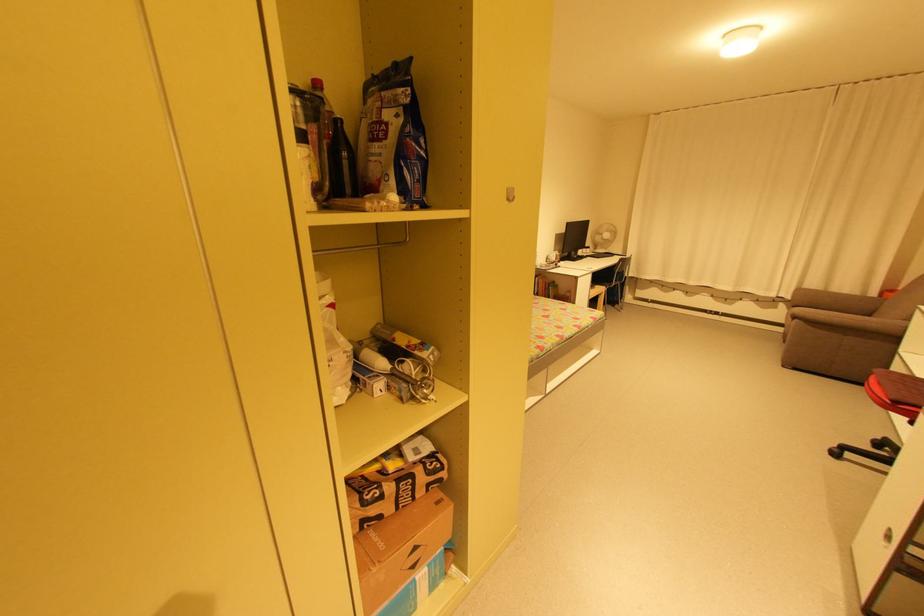
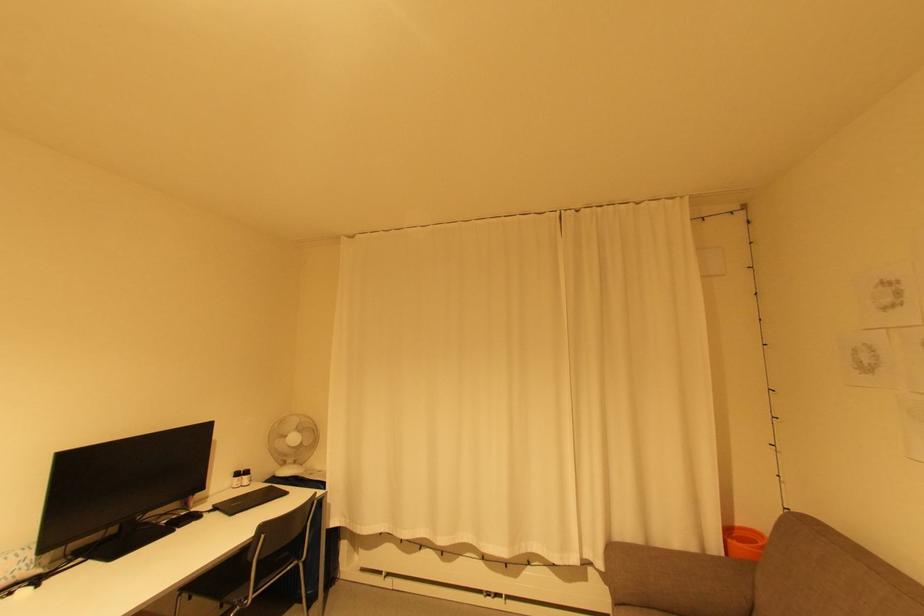
In the second image, find the point that corresponds to (x=611, y=236) in the first image.

(298, 439)